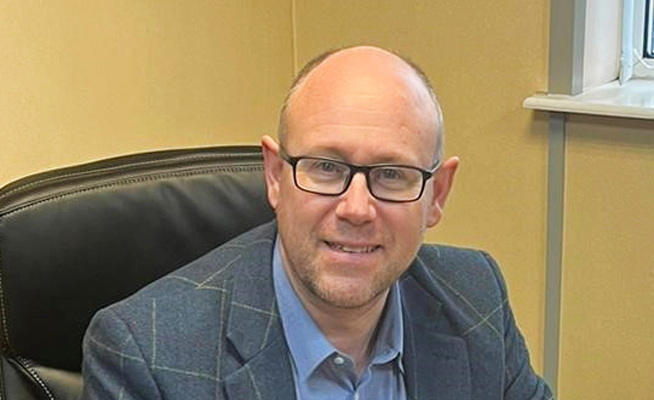
Identify the location of metal vertical strip under window on wall. (547, 354), (545, 245), (556, 149).